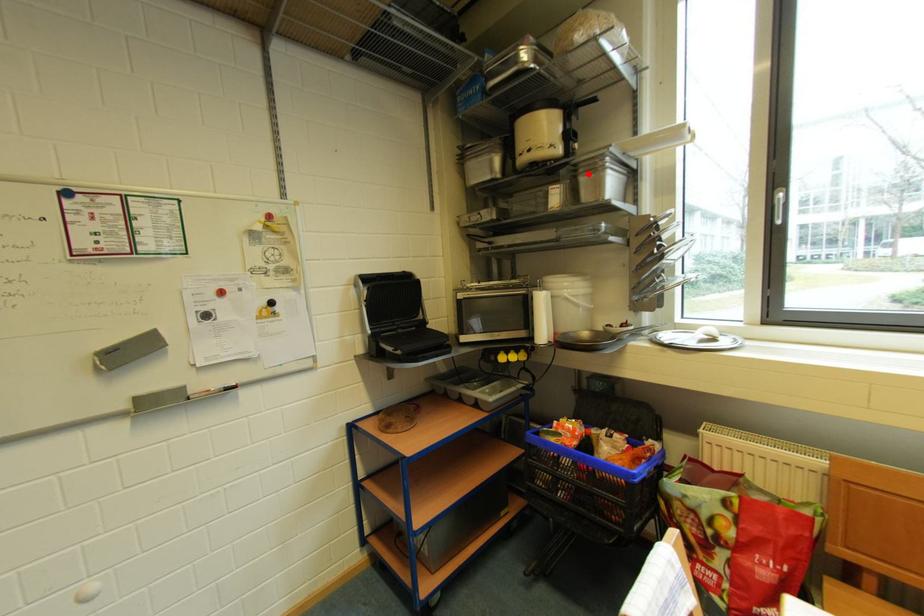
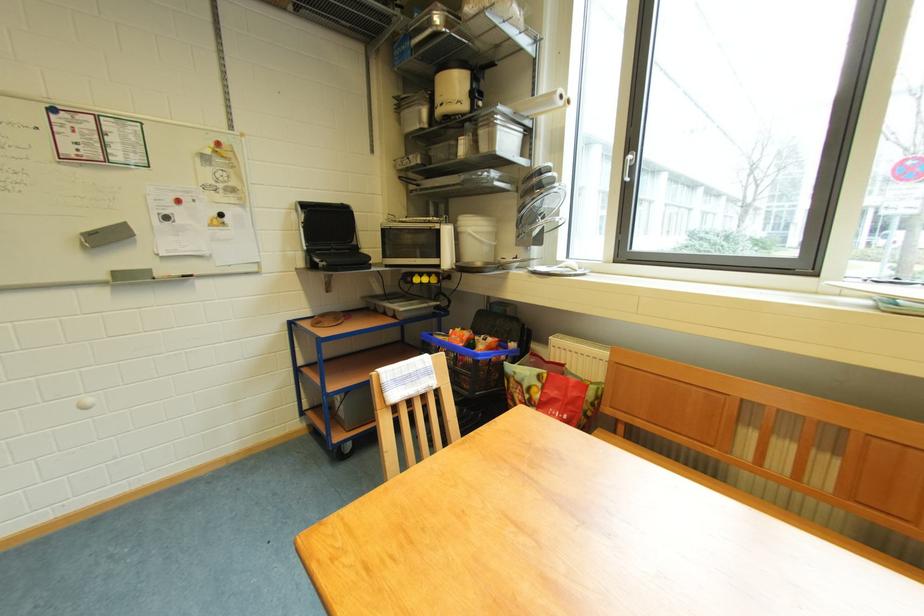
In the second image, find the point that corresponds to the highlighted location in the first image.

(488, 127)